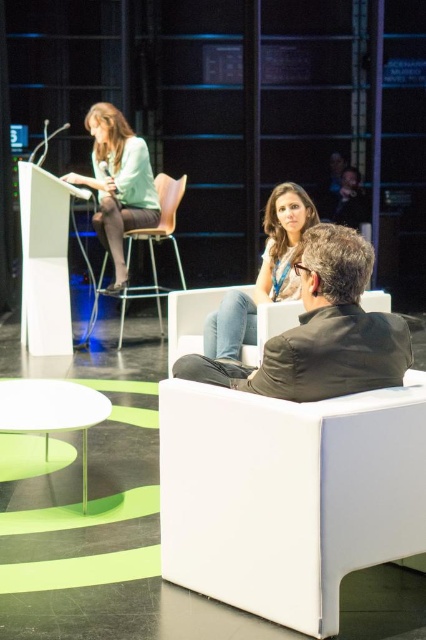
You are sitting on a chair in the conference room and want to hand a document to the person wearing the dark brown leather jacket at center. The document is on the matte black stool at center. Can you reach it without moving from your seat?

The dark brown leather jacket at center is closer to the viewer than the matte black stool at center, so you can reach the document on the matte black stool at center as it is farther away but still within reach.

You are sitting in the conference room and want to hand a document to both the person in the dark brown leather jacket at center and the person in the matte green shirt at upper left. Which person should you approach first to ensure you can reach them without moving too far from your seat?

You should approach the dark brown leather jacket at center first because it is closer to you than the matte green shirt at upper left, so it requires less movement from your current position.

You are standing in the conference room and notice two points marked in the scene. Which point is nearer to you, point (x=307, y=307) or point (x=184, y=186)?

Point (x=307, y=307) is closer to the viewer than point (x=184, y=186).